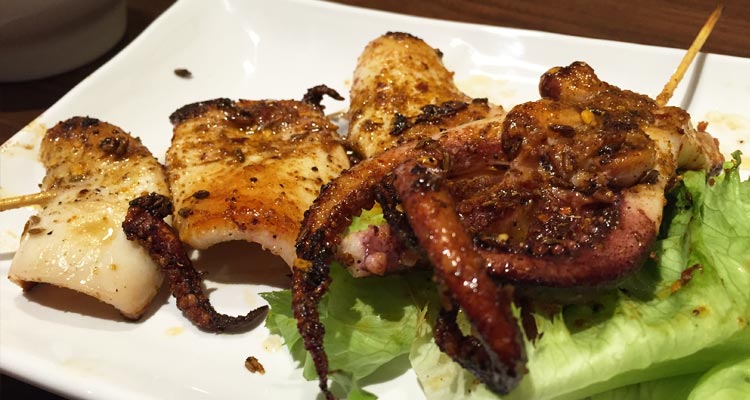
What are the coordinates of `right creamy white corner of porcelain plate top` in the screenshot? It's located at (217, 19).